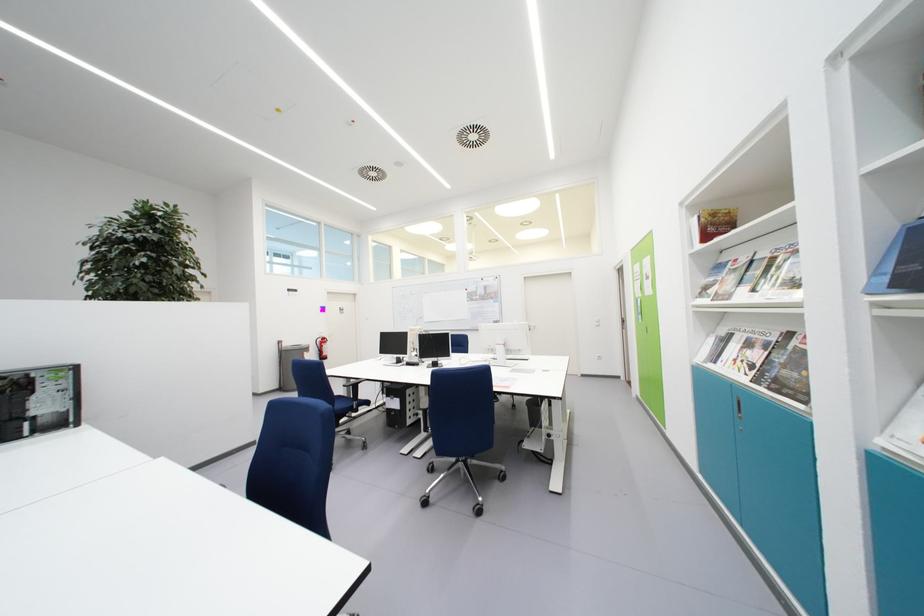
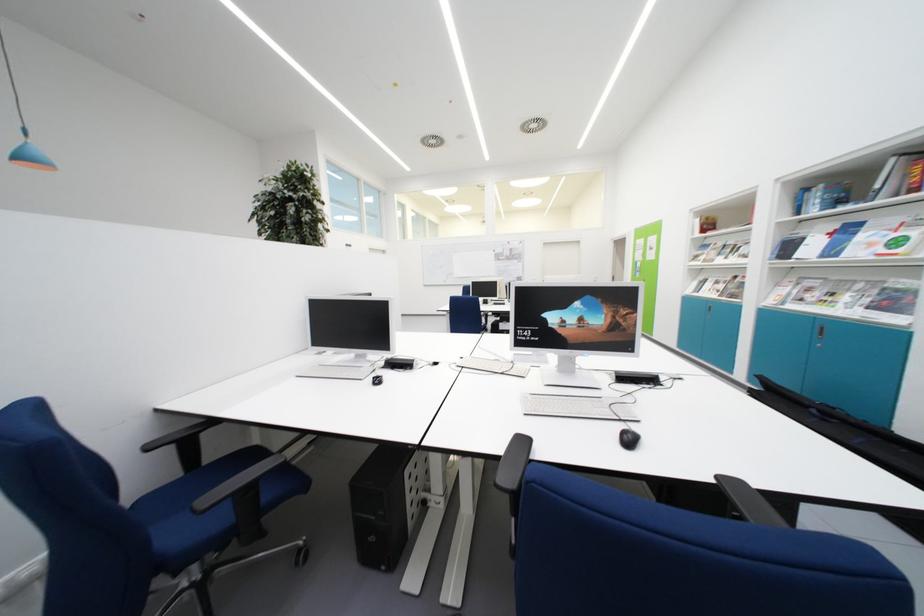
In a continuous first-person perspective shot, in which direction is the camera moving?

The cameraman moved toward left, backward.